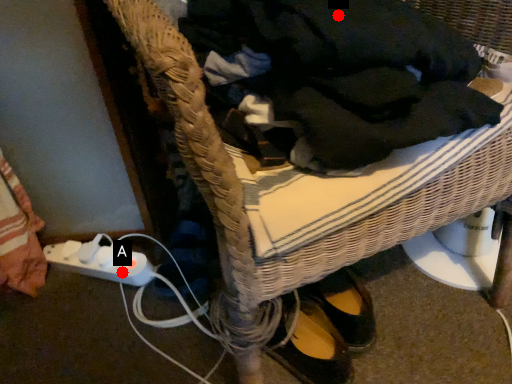
Question: Two points are circled on the image, labeled by A and B beside each circle. Which point is farther from the camera taking this photo?

Choices:
 (A) A is further
 (B) B is further

Answer: (A)